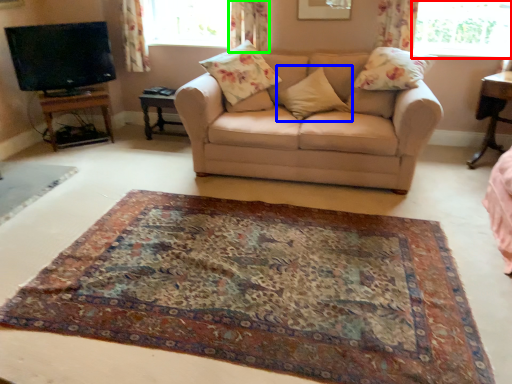
Question: Which object is the closest to the window (highlighted by a red box)? Choose among these: pillow (highlighted by a blue box) or curtain (highlighted by a green box).

Choices:
 (A) pillow
 (B) curtain

Answer: (A)